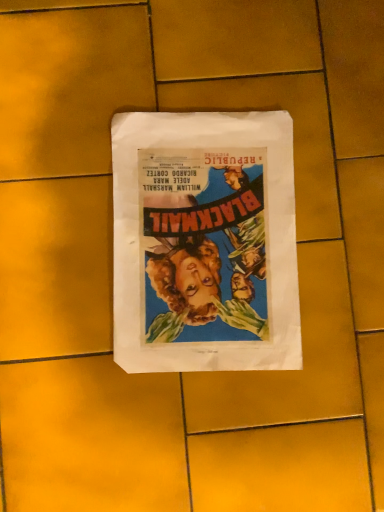
Identify the location of blank space situated above matte paper poster at center (from a real-world perspective). (202, 241).